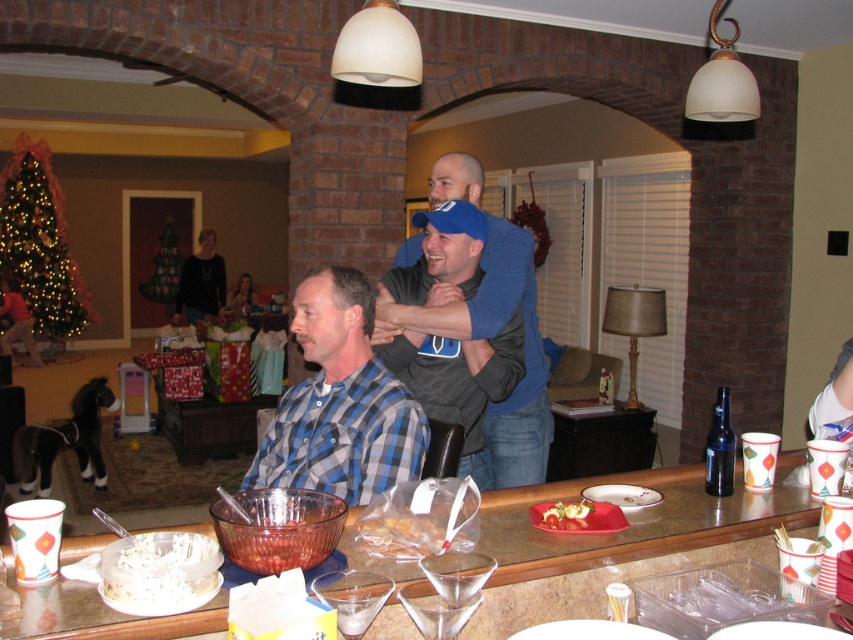
You are standing in the room and want to place a 4 feet long decorative item on the translucent glass table at center. Can you fit it on the table without it hanging over the edges?

The translucent glass table at center is 4.17 feet from viewer, so the 4 feet long decorative item can be placed on it without hanging over the edges since it is shorter than the table length.

Looking at this image, you are planning to place a new decorative item on the translucent glass table at center. According to the scene description, where exactly should you place it?

The translucent glass table at center should have the decorative item placed at point (637, 522) as per the coordinates provided.

You are a guest at this holiday party and need to grab a drink from the bar. You are standing at the bar counter. The blue plaid shirt at center is blocking your path to the transparent plastic martini glass at lower center. Can you reach the glass without moving the shirt?

The blue plaid shirt at center and transparent plastic martini glass at lower center are 30.00 inches apart from each other. Since the distance between them is 30 inches, you can likely reach the glass without moving the shirt as there is enough space between them.